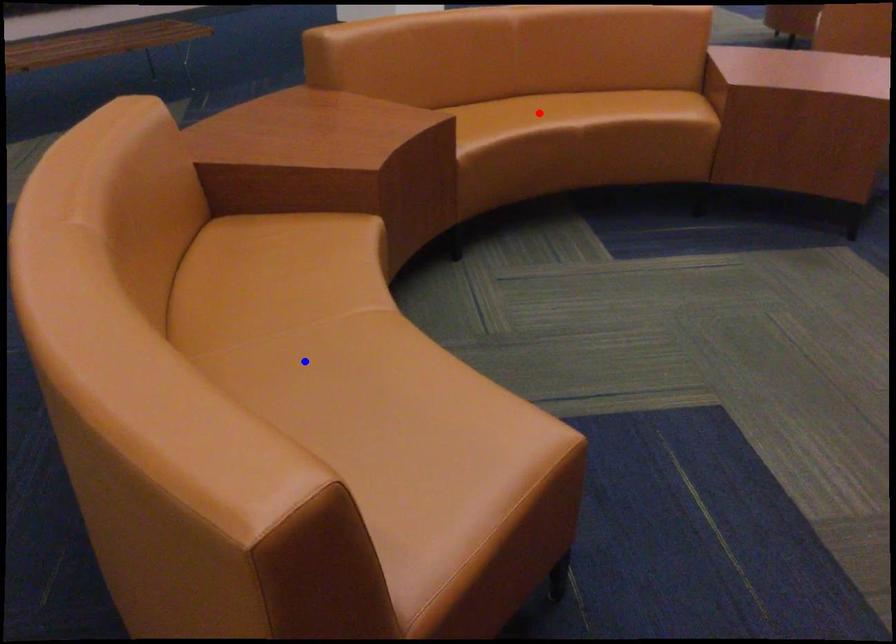
Question: Two points are marked on the image. Which point is closer to the camera?

Choices:
 (A) Blue point is closer.
 (B) Red point is closer.

Answer: (A)